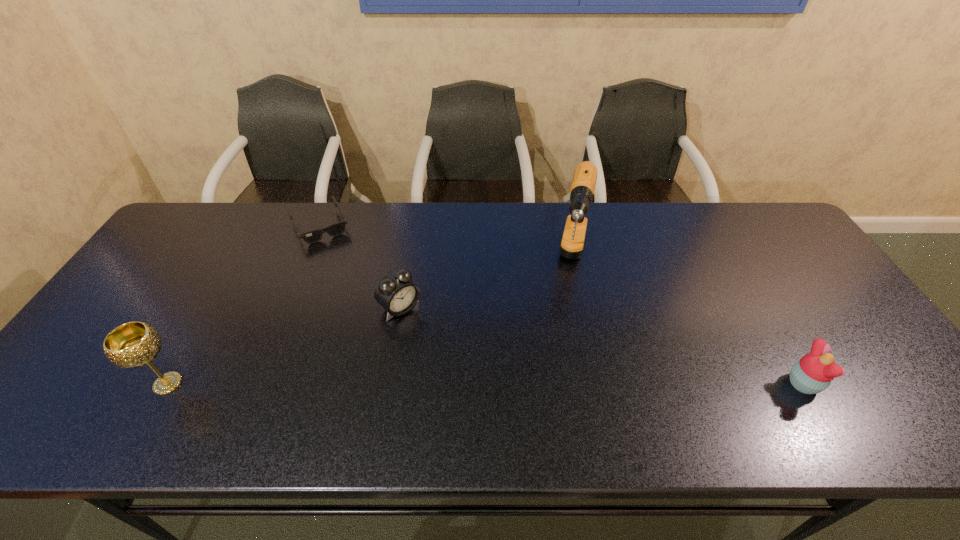
In order to click on the leftmost object in this screenshot , I will do `click(134, 344)`.

Locate an element on the screen. This screenshot has width=960, height=540. chalice is located at coordinates (134, 344).

Image resolution: width=960 pixels, height=540 pixels. I want to click on cupcake, so click(x=813, y=373).

Locate an element on the screen. The width and height of the screenshot is (960, 540). the third object from left to right is located at coordinates (396, 292).

You are a GUI agent. You are given a task and a screenshot of the screen. Output one action in this format:
    pyautogui.click(x=<x>, y=<y>)
    Task: Click on the sunglasses
    The width and height of the screenshot is (960, 540).
    Given the screenshot: What is the action you would take?
    pyautogui.click(x=314, y=236)

Where is `the second object from left to right`? This screenshot has width=960, height=540. the second object from left to right is located at coordinates (314, 236).

Find the location of a particular element. Image resolution: width=960 pixels, height=540 pixels. drill is located at coordinates pos(583,185).

Locate an element on the screen. This screenshot has width=960, height=540. the tallest object is located at coordinates click(583, 185).

Identify the location of vacant area situated on the right of the leftmost object. (214, 384).

The height and width of the screenshot is (540, 960). What are the coordinates of `vacant space located 0.170m on the face of the rightmost object` in the screenshot? It's located at (893, 384).